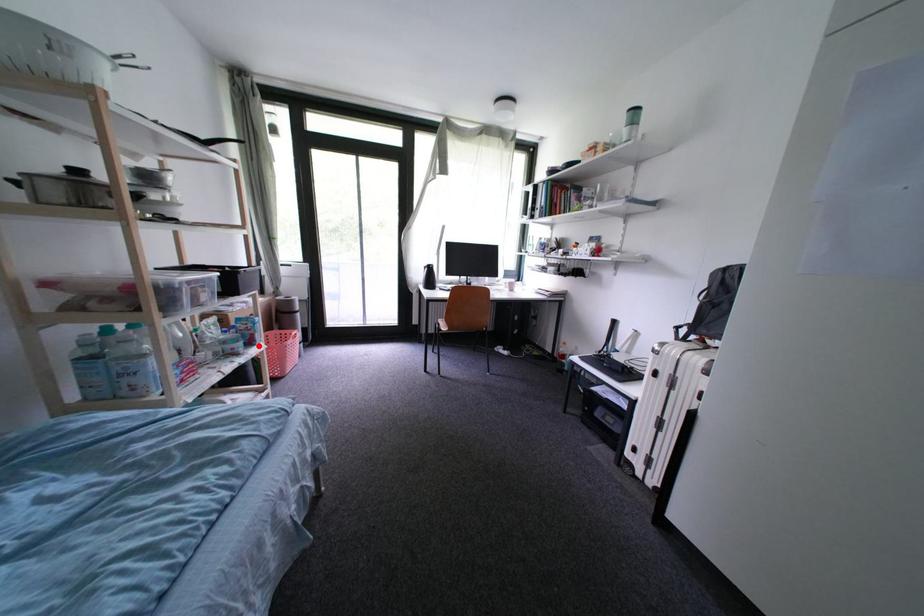
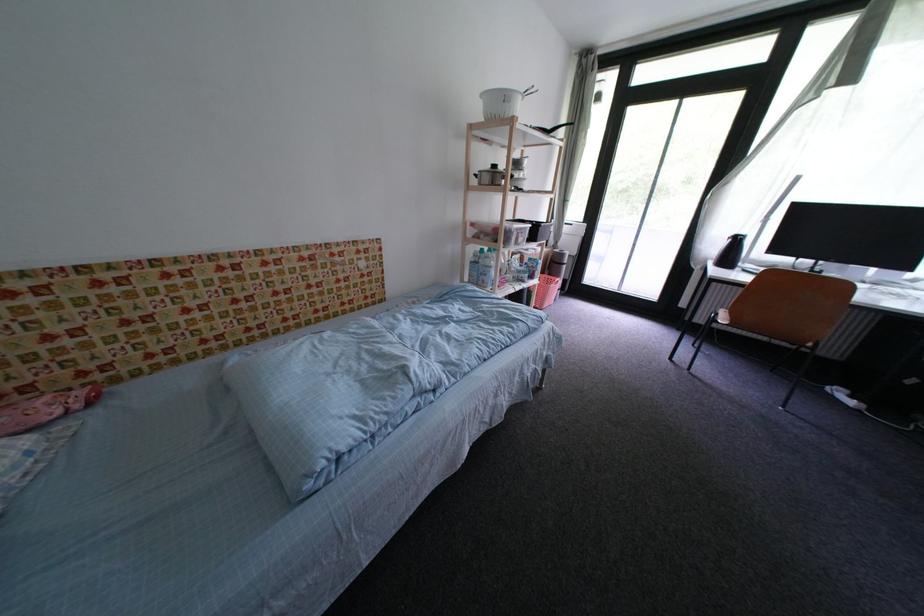
Locate, in the second image, the point that corresponds to the highlighted location in the first image.

(540, 280)